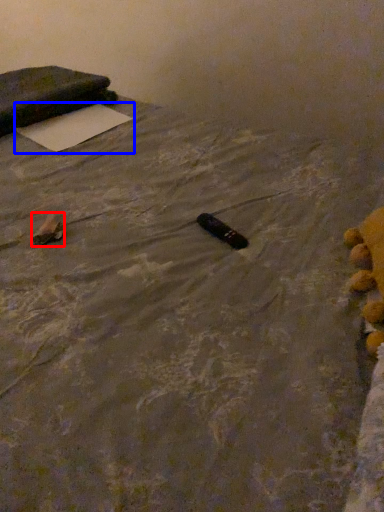
Question: Which object is closer to the camera taking this photo, waste (highlighted by a red box) or yoga mat (highlighted by a blue box)?

Choices:
 (A) waste
 (B) yoga mat

Answer: (A)